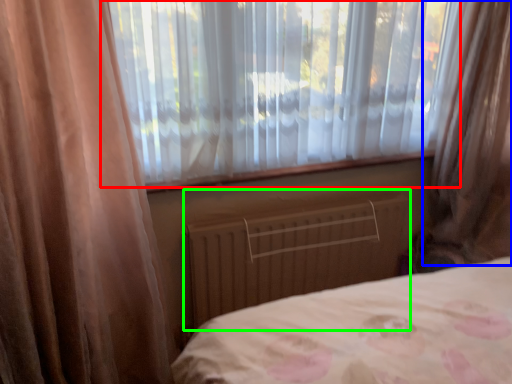
Question: Estimate the real-world distances between objects in this image. Which object is farther from window (highlighted by a red box), curtain (highlighted by a blue box) or radiator (highlighted by a green box)?

Choices:
 (A) curtain
 (B) radiator

Answer: (A)